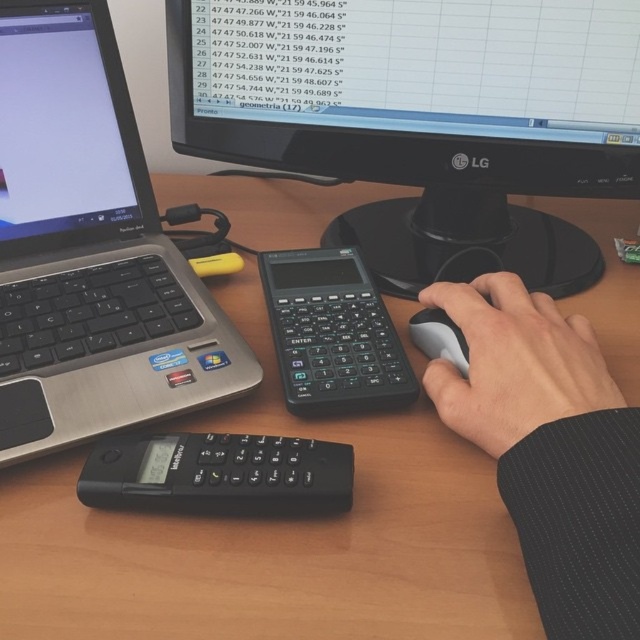
Question: Does wooden table at center appear on the right side of black plastic monitor at upper center?

Choices:
 (A) no
 (B) yes

Answer: (A)

Question: Which point is farther from the camera taking this photo?

Choices:
 (A) (93, 237)
 (B) (86, 314)

Answer: (A)

Question: Is black plastic monitor at upper center bigger than black plastic calculator at center?

Choices:
 (A) yes
 (B) no

Answer: (A)

Question: Is satin silver laptop at left positioned at the back of matte black laptop at left?

Choices:
 (A) no
 (B) yes

Answer: (A)

Question: Which of the following is the closest to the observer?

Choices:
 (A) black plastic calculator at center
 (B) wooden table at center
 (C) satin silver laptop at left

Answer: (B)

Question: Which object is positioned closest to the black matte mouse at center?

Choices:
 (A) black plastic keyboard at left
 (B) wooden table at center

Answer: (B)